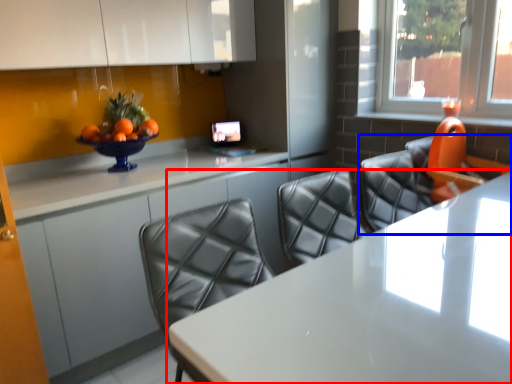
Question: Among these objects, which one is nearest to the camera, table (highlighted by a red box) or chair (highlighted by a blue box)?

Choices:
 (A) table
 (B) chair

Answer: (A)